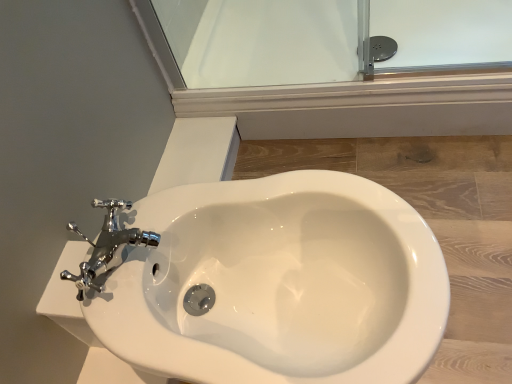
Question: From the image's perspective, is white glossy bidet at center located above transparent glass door at upper center?

Choices:
 (A) yes
 (B) no

Answer: (B)

Question: Does white glossy bidet at center have a greater height compared to transparent glass door at upper center?

Choices:
 (A) yes
 (B) no

Answer: (A)

Question: Considering the relative sizes of white glossy bidet at center and transparent glass door at upper center in the image provided, is white glossy bidet at center wider than transparent glass door at upper center?

Choices:
 (A) no
 (B) yes

Answer: (A)

Question: Does white glossy bidet at center appear on the right side of transparent glass door at upper center?

Choices:
 (A) no
 (B) yes

Answer: (A)

Question: From a real-world perspective, is white glossy bidet at center on transparent glass door at upper center?

Choices:
 (A) yes
 (B) no

Answer: (A)

Question: From the image's perspective, is transparent glass door at upper center located above or below chrome metallic faucet at upper left?

Choices:
 (A) below
 (B) above

Answer: (B)

Question: From a real-world perspective, is transparent glass door at upper center above or below chrome metallic faucet at upper left?

Choices:
 (A) above
 (B) below

Answer: (B)

Question: Is transparent glass door at upper center to the left or to the right of chrome metallic faucet at upper left in the image?

Choices:
 (A) left
 (B) right

Answer: (B)

Question: In the image, is transparent glass door at upper center positioned in front of or behind chrome metallic faucet at upper left?

Choices:
 (A) behind
 (B) front

Answer: (A)

Question: From the image's perspective, relative to chrome metallic faucet at upper left, is white glossy bidet at center above or below?

Choices:
 (A) below
 (B) above

Answer: (A)

Question: Does point (159, 339) appear closer or farther from the camera than point (116, 243)?

Choices:
 (A) closer
 (B) farther

Answer: (A)

Question: From a real-world perspective, is white glossy bidet at center physically located above or below chrome metallic faucet at upper left?

Choices:
 (A) above
 (B) below

Answer: (B)

Question: Is white glossy bidet at center in front of or behind chrome metallic faucet at upper left in the image?

Choices:
 (A) front
 (B) behind

Answer: (A)

Question: Is white glossy bidet at center in front of or behind transparent glass door at upper center in the image?

Choices:
 (A) front
 (B) behind

Answer: (A)

Question: From a real-world perspective, is white glossy bidet at center positioned above or below transparent glass door at upper center?

Choices:
 (A) above
 (B) below

Answer: (A)